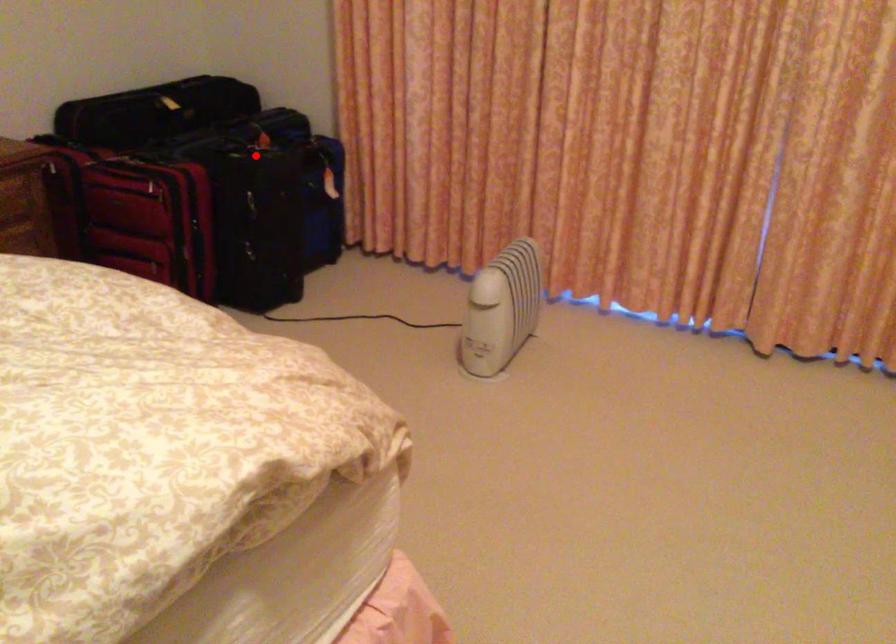
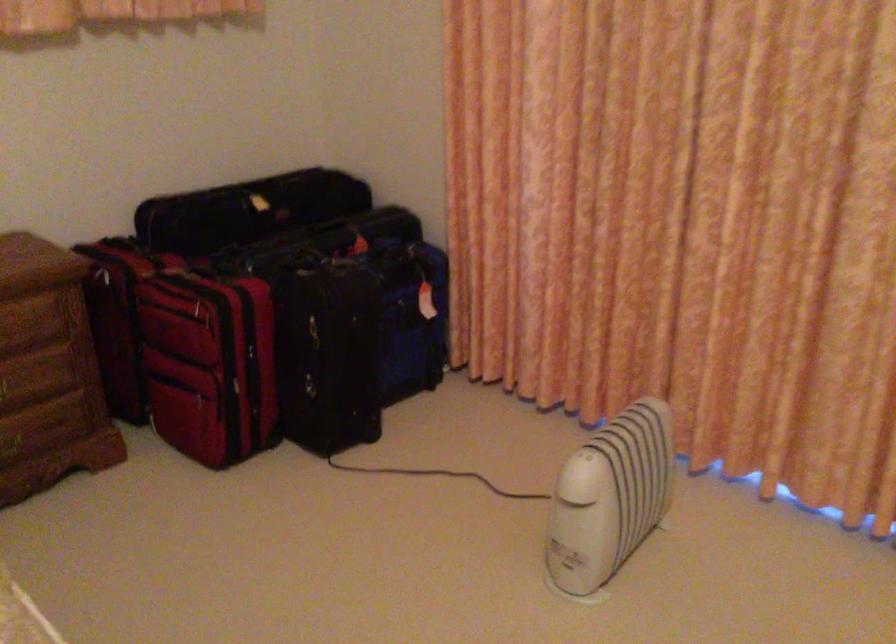
The point at the highlighted location is marked in the first image. Where is the corresponding point in the second image?

(330, 266)